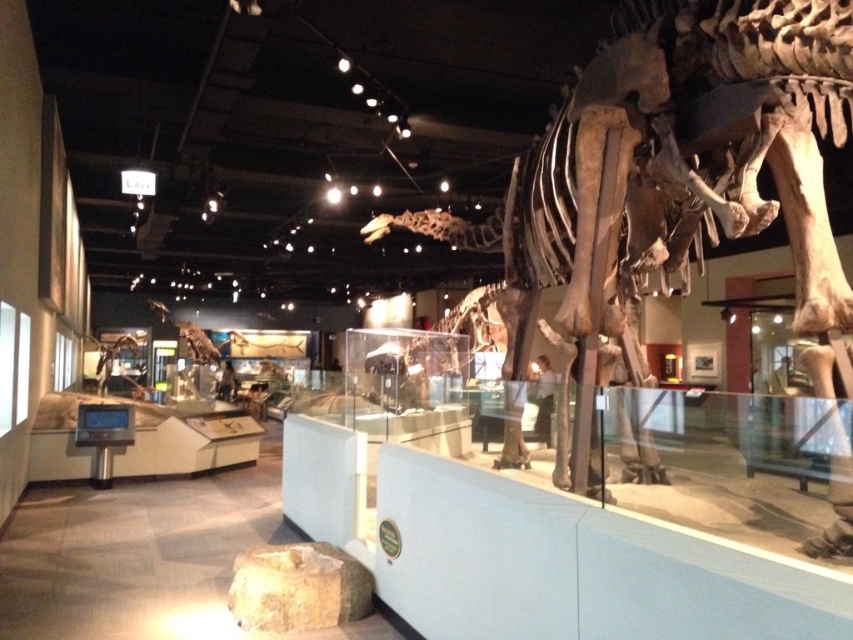
Question: From the image, what is the correct spatial relationship of shiny metallic dinosaur at lower left in relation to shiny metallic dinosaur skeleton at center?

Choices:
 (A) left
 (B) right

Answer: (A)

Question: Can you confirm if shiny metallic dinosaur at lower left is positioned above shiny metallic dinosaur skeleton at center?

Choices:
 (A) yes
 (B) no

Answer: (B)

Question: Which point is closer to the camera?

Choices:
 (A) shiny metallic dinosaur at lower left
 (B) shiny metallic dinosaur skeleton at center

Answer: (A)

Question: Does shiny metallic dinosaur at lower left have a greater width compared to shiny metallic dinosaur skeleton at center?

Choices:
 (A) yes
 (B) no

Answer: (A)